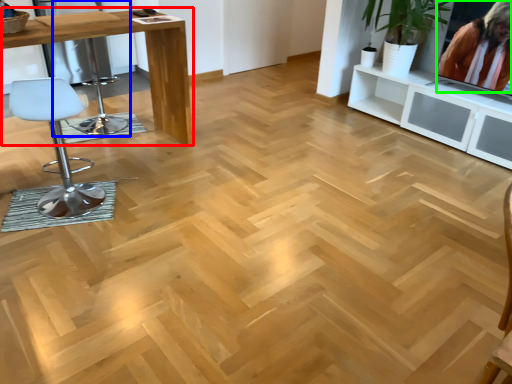
Question: Which object is the closest to the table (highlighted by a red box)? Choose among these: swivel chair (highlighted by a blue box) or person (highlighted by a green box).

Choices:
 (A) swivel chair
 (B) person

Answer: (A)